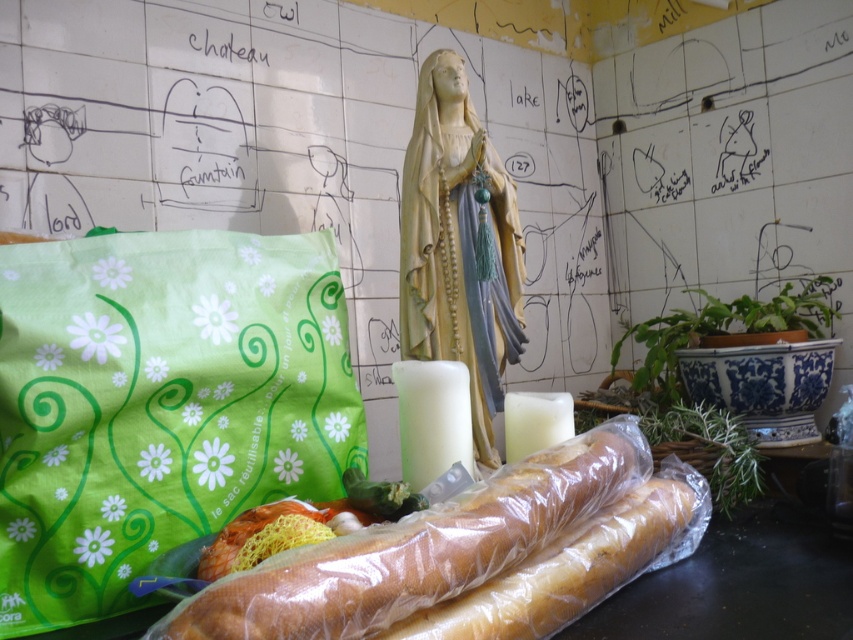
Can you confirm if matte beige statue at center is taller than golden brown baguette at center?

Correct, matte beige statue at center is much taller as golden brown baguette at center.

This screenshot has height=640, width=853. I want to click on matte beige statue at center, so click(457, 246).

Which is above, matte beige statue at center or white matte candle at center?

matte beige statue at center is higher up.

Between matte beige statue at center and white matte candle at center, which one appears on the left side from the viewer's perspective?

Positioned to the left is white matte candle at center.

You are a GUI agent. You are given a task and a screenshot of the screen. Output one action in this format:
    pyautogui.click(x=<x>, y=<y>)
    Task: Click on the matte beige statue at center
    Image resolution: width=853 pixels, height=640 pixels.
    Given the screenshot: What is the action you would take?
    pyautogui.click(x=457, y=246)

Is golden brown baguette at center to the left of translucent plastic bag at center from the viewer's perspective?

No, golden brown baguette at center is not to the left of translucent plastic bag at center.

Between point (683, 524) and point (231, 552), which one is positioned in front?

Point (231, 552) is more forward.

Is point (519, 620) positioned in front of point (370, 484)?

Yes.

Where is `golden brown baguette at center`? The image size is (853, 640). golden brown baguette at center is located at coordinates (573, 566).